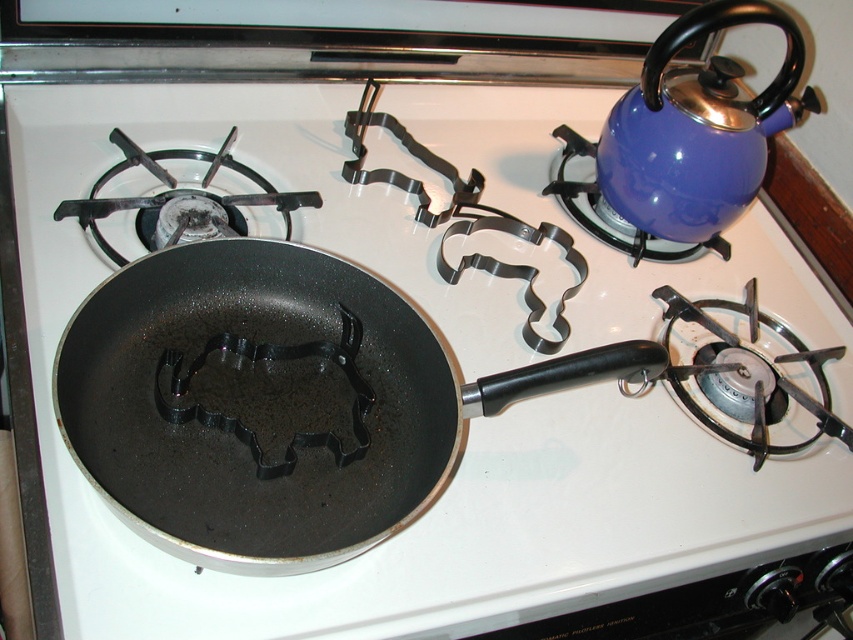
You are standing in front of the stove and see two points marked on the image. Which point is closer to you, point (338, 342) or point (608, 200)?

Point (338, 342) is in front of point (608, 200), so it is closer to you.